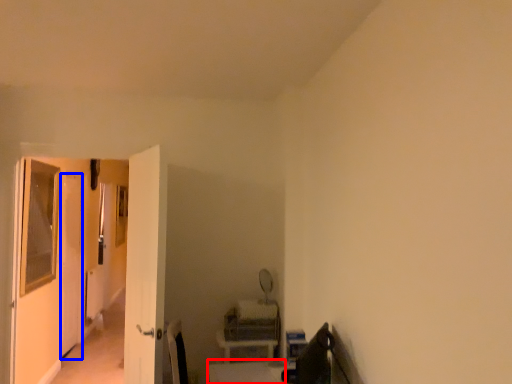
Question: Which object appears closest to the camera in this image, table (highlighted by a red box) or screen door (highlighted by a blue box)?

Choices:
 (A) table
 (B) screen door

Answer: (A)